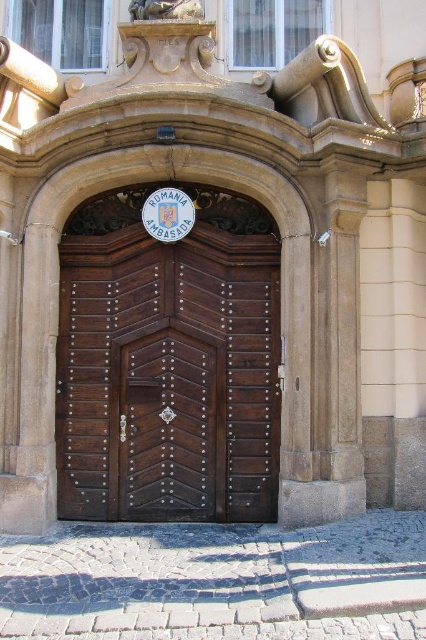
You are an architect visiting the Romanian Embassy and notice two doors at the entrance. One is labeled as the polished wood door at center and the other as the dark wood door at center. Which door is taller?

The polished wood door at center is much taller than the dark wood door at center.

You are a visitor approaching the Romanian Embassy entrance. You notice two doors labeled as the polished wood door at center and the dark wood door at center. Which door should you enter through based on their positions?

The polished wood door at center is above the dark wood door at center, so you should enter through the dark wood door at center since it is the lower and more accessible entrance.